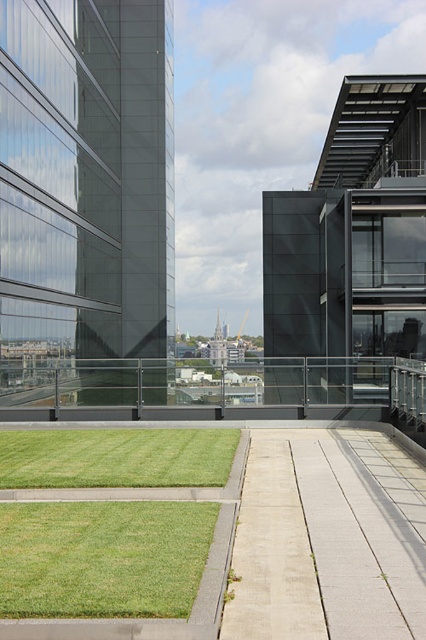
You are standing on the rooftop and want to move from the grassy area to the walkway. There are two points marked as point 1 at coordinates point (40, 380) and point 2 at coordinates point (120, 454). Which point is closer to you as you stand on the grassy area?

Point (40, 380) is closer to you because it is further to the viewer than point (120, 454), meaning it is physically nearer in the space.

You are a landscape architect designing a rooftop garden. You have two patches of green grass at lower left and green grass at center. Which patch has a more lush appearance?

The green grass at center has a more lush appearance because it is thicker than the green grass at lower left.

You are planning to install a new bench on the rooftop. The bench requires a space that is larger than the green grass at center. Can the black glass railing at center provide enough space for the bench?

The black glass railing at center has a larger size compared to green grass at center, so yes, the black glass railing at center can provide enough space for the bench since it is larger than the required area.